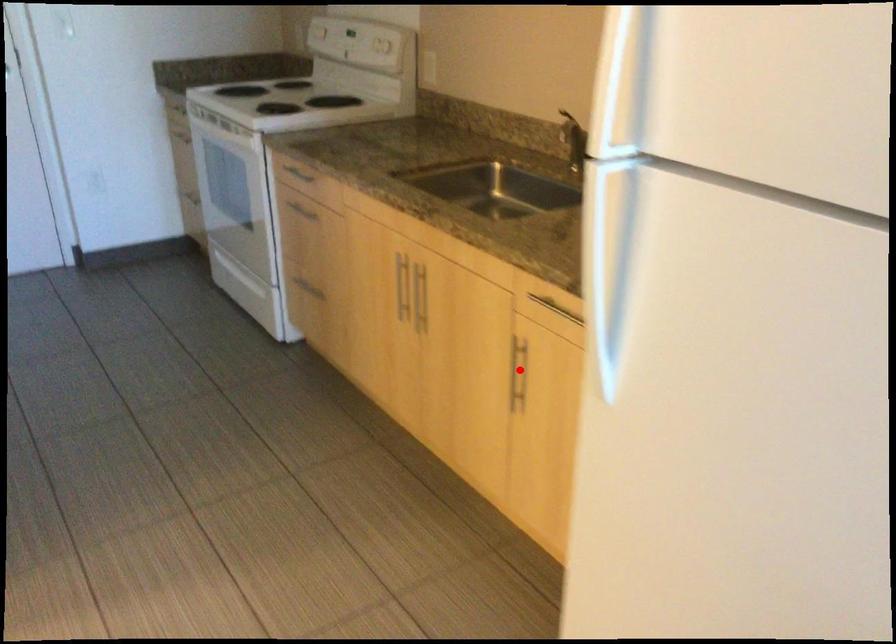
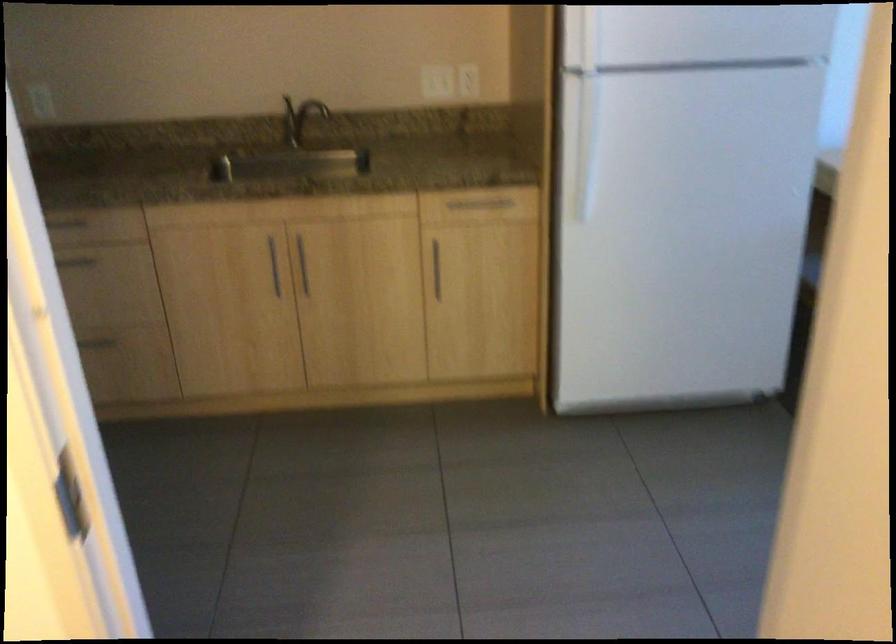
Question: I am providing you with two images of the same scene from different viewpoints. Given a red point in image1, look at the same physical point in image2. Is it:

Choices:
 (A) Closer to the viewpoint
 (B) Farther from the viewpoint

Answer: (B)